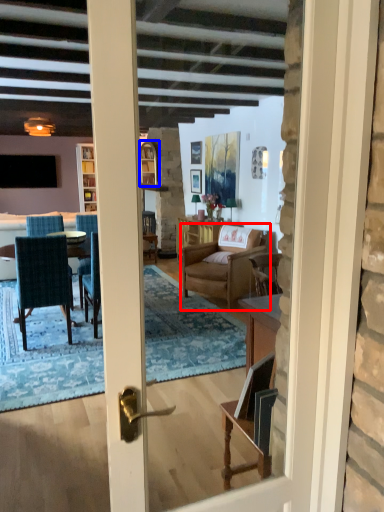
Question: Which of the following is the farthest to the observer, chair (highlighted by a red box) or window (highlighted by a blue box)?

Choices:
 (A) chair
 (B) window

Answer: (B)